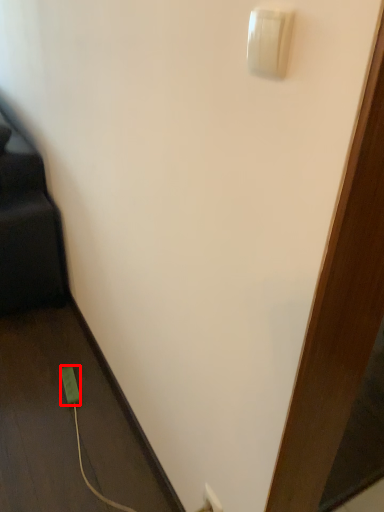
Question: From the image's perspective, what is the correct spatial positioning of power plugs and sockets (annotated by the red box) in reference to light switch?

Choices:
 (A) below
 (B) above

Answer: (A)